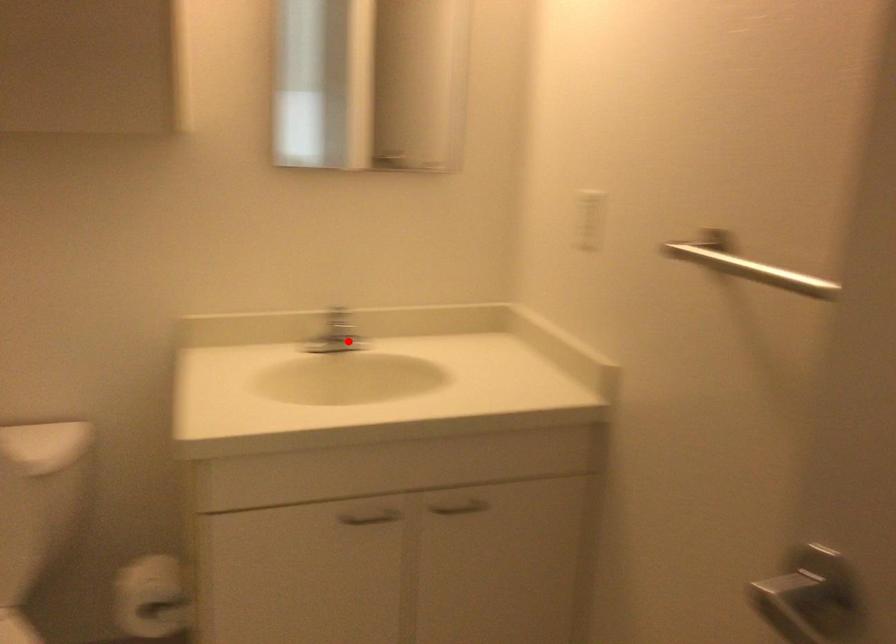
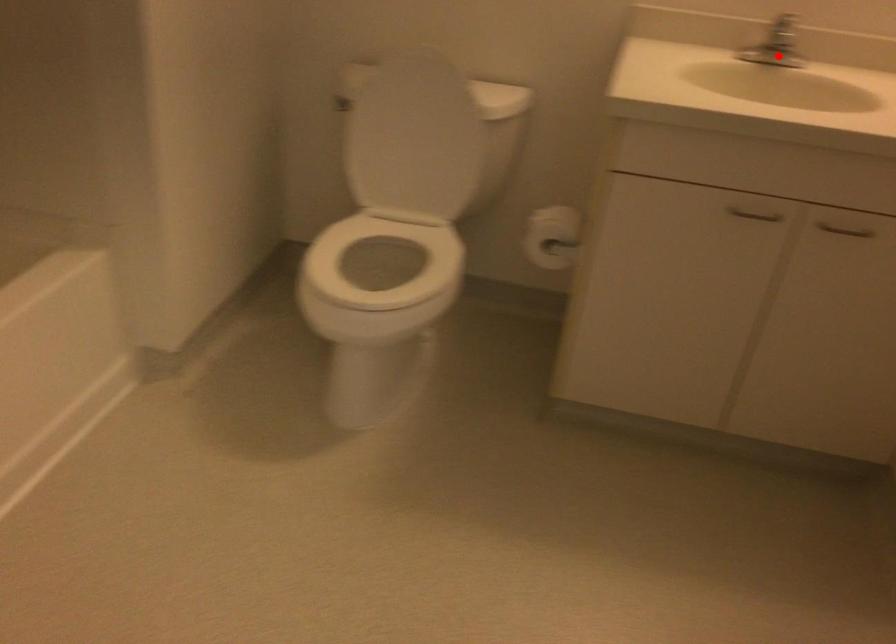
I am providing you with two images of the same scene from different viewpoints. A red point is marked on the first image and another point is marked on the second image. Is the marked point in image1 the same physical position as the marked point in image2?

Yes